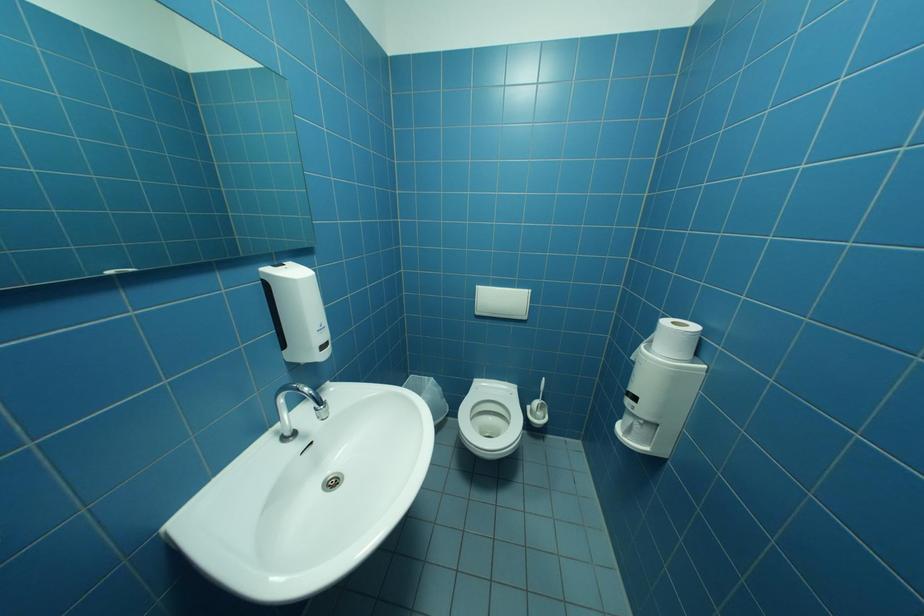
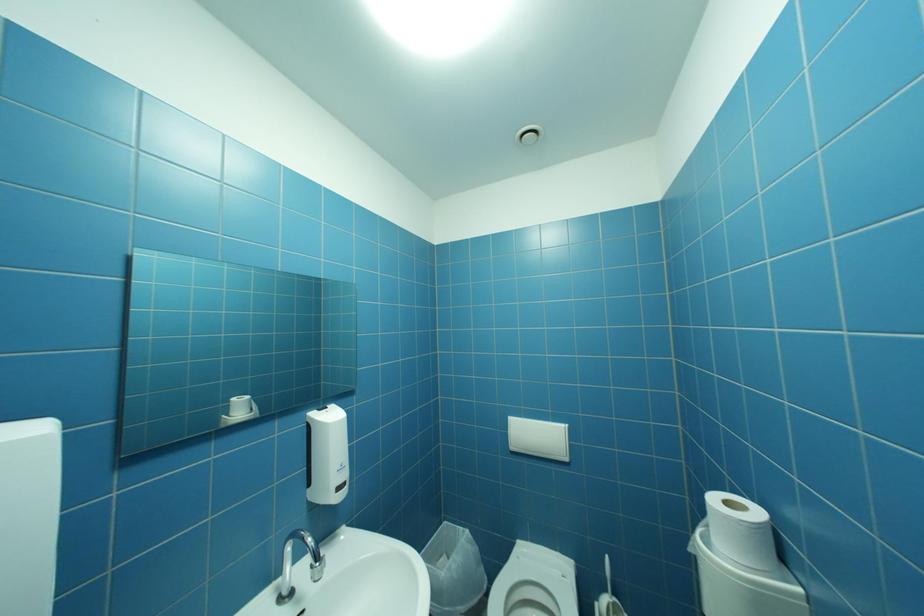
How did the camera likely rotate?

The rotation direction of the camera is left-up.